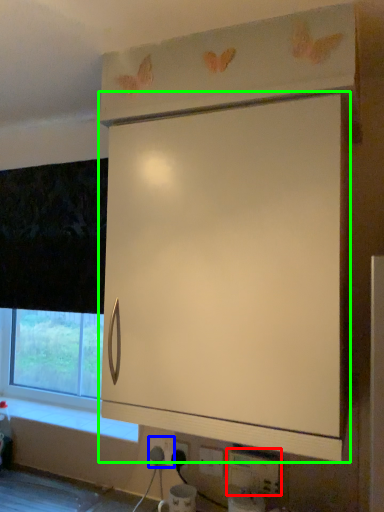
Question: Which object is the closest to the electric outlet (highlighted by a red box)? Choose among these: electric outlet (highlighted by a blue box) or cabinetry (highlighted by a green box).

Choices:
 (A) electric outlet
 (B) cabinetry

Answer: (A)